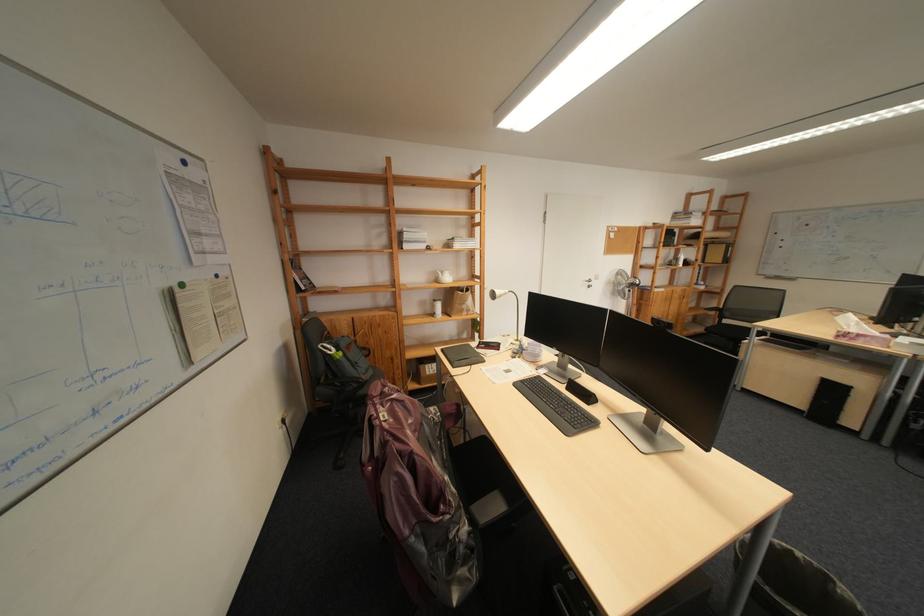
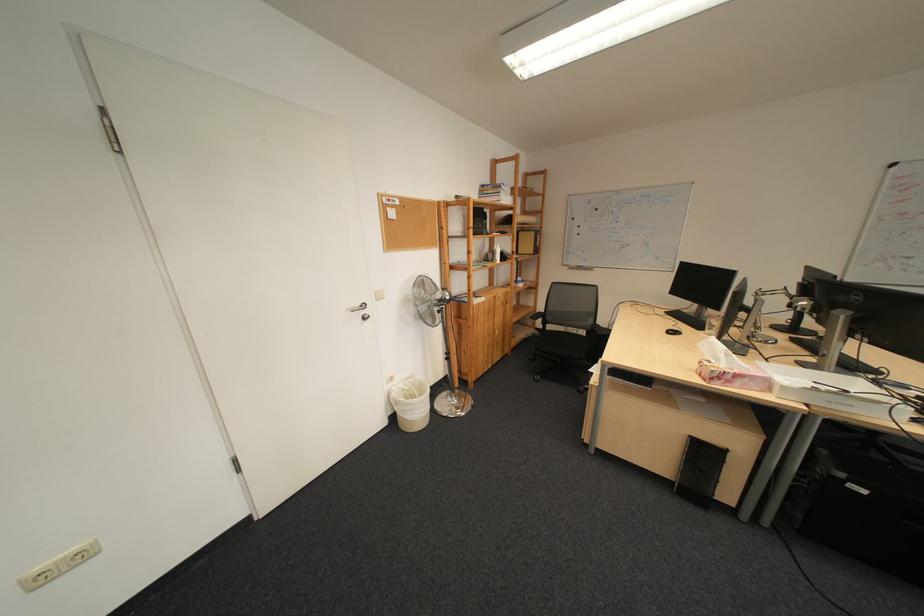
Find the pixel in the second image that matches (676,264) in the first image.

(492, 257)